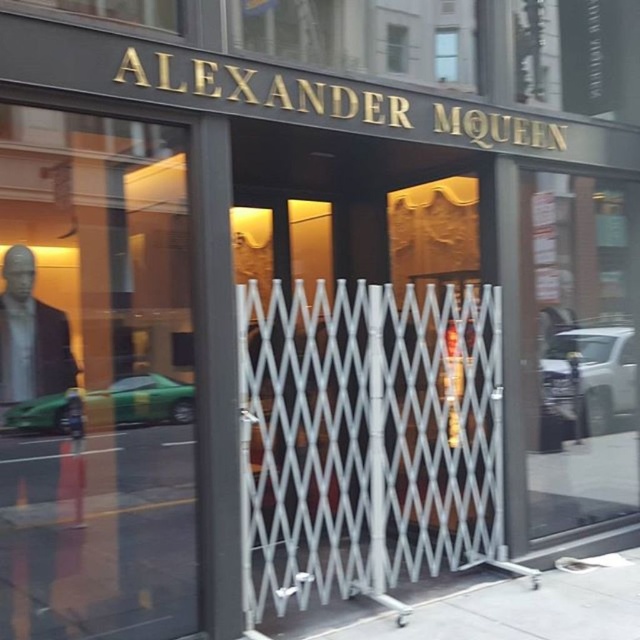
Can you confirm if metallic silver gate at center is positioned to the right of transparent glass door at center?

In fact, metallic silver gate at center is to the left of transparent glass door at center.

Which is above, metallic silver gate at center or transparent glass door at center?

transparent glass door at center

Where is `metallic silver gate at center`? Image resolution: width=640 pixels, height=640 pixels. metallic silver gate at center is located at coordinates [365, 440].

Who is more distant from viewer, (176, 205) or (625, 352)?

The point (625, 352) is behind.

Can you confirm if green glass mannequin at left is thinner than transparent glass door at center?

Correct, green glass mannequin at left's width is less than transparent glass door at center's.

Between point (90, 193) and point (557, 252), which one is positioned behind?

The point (557, 252) is behind.

Where is `green glass mannequin at left`? The image size is (640, 640). green glass mannequin at left is located at coordinates (93, 380).

Measure the distance from green glass mannequin at left to metallic silver gate at center.

green glass mannequin at left is 1.00 meters away from metallic silver gate at center.

Can you confirm if green glass mannequin at left is positioned to the right of metallic silver gate at center?

Incorrect, green glass mannequin at left is not on the right side of metallic silver gate at center.

Find the location of `green glass mannequin at left`. green glass mannequin at left is located at coordinates (93, 380).